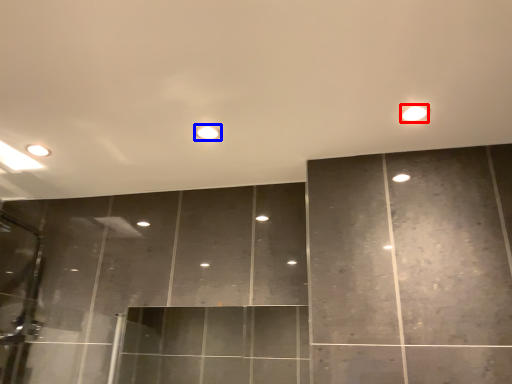
Question: Which object appears closest to the camera in this image, light (highlighted by a red box) or light (highlighted by a blue box)?

Choices:
 (A) light
 (B) light

Answer: (A)